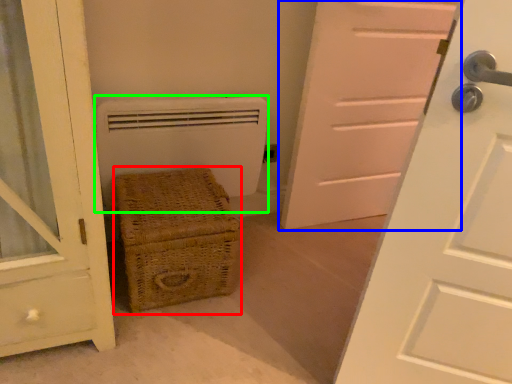
Question: Considering the real-world distances, which object is closest to furniture (highlighted by a red box)? door (highlighted by a blue box) or heater (highlighted by a green box).

Choices:
 (A) door
 (B) heater

Answer: (B)